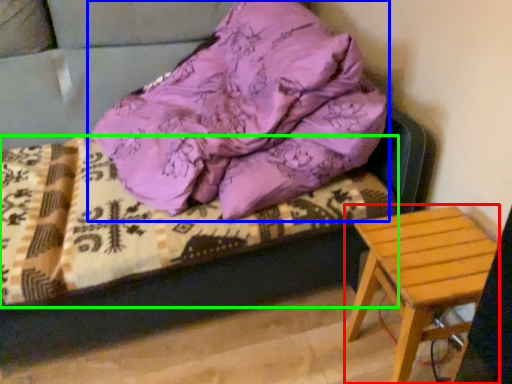
Question: Which object is positioned closest to stool (highlighted by a red box)? Select from pillow (highlighted by a blue box) and bedding (highlighted by a green box).

Choices:
 (A) pillow
 (B) bedding

Answer: (B)